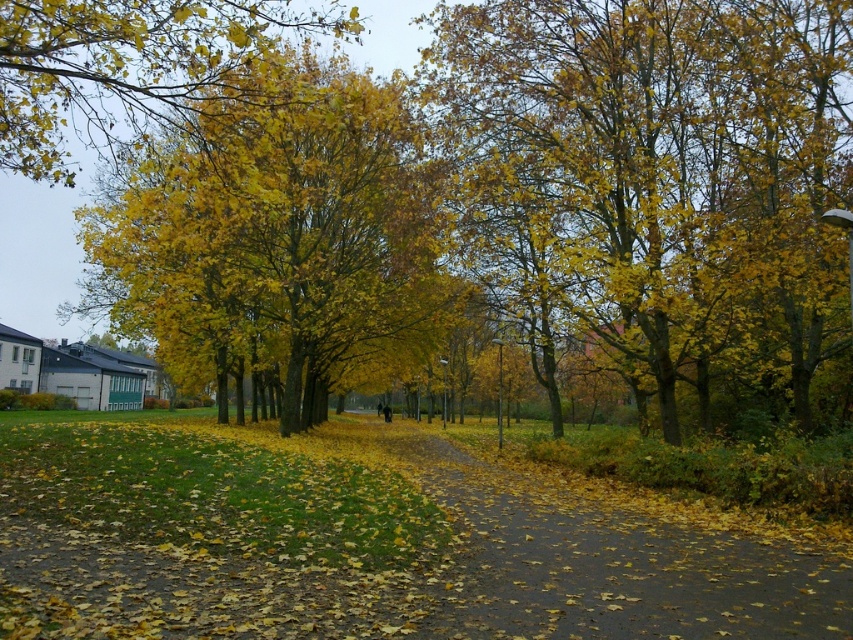
Between point (334, 228) and point (677, 515), which one is positioned behind?

Point (334, 228)

Can you confirm if yellow leafy tree at center is shorter than brown asphalt path at center?

No, yellow leafy tree at center is not shorter than brown asphalt path at center.

The width and height of the screenshot is (853, 640). What do you see at coordinates (287, 237) in the screenshot?
I see `yellow leafy tree at center` at bounding box center [287, 237].

Where is `yellow leafy tree at center`? The height and width of the screenshot is (640, 853). yellow leafy tree at center is located at coordinates (287, 237).

Which is more to the right, yellow-green leaves at center or yellow matte leaves at upper left?

Positioned to the right is yellow-green leaves at center.

Describe the element at coordinates (664, 176) in the screenshot. This screenshot has height=640, width=853. I see `yellow-green leaves at center` at that location.

Describe the element at coordinates (664, 176) in the screenshot. I see `yellow-green leaves at center` at that location.

Locate an element on the screen. yellow-green leaves at center is located at coordinates (664, 176).

Does point (512, 120) come closer to viewer compared to point (534, 500)?

No, it is behind (534, 500).

Looking at this image, is yellow-green leaves at center shorter than brown asphalt path at center?

Incorrect, yellow-green leaves at center's height does not fall short of brown asphalt path at center's.

Is point (724, 243) more distant than point (744, 522)?

Yes, point (724, 243) is farther from viewer.

The width and height of the screenshot is (853, 640). In order to click on yellow-green leaves at center in this screenshot , I will do `click(664, 176)`.